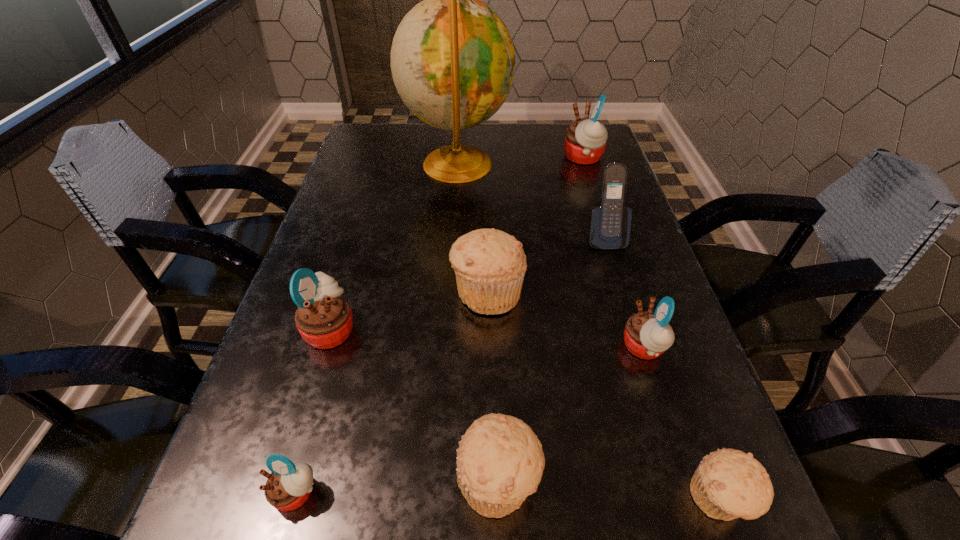
Find the location of a particular element. the tallest object is located at coordinates coord(453,62).

What are the coordinates of `the tallest muffin` in the screenshot? It's located at (585, 140).

Locate an element on the screen. This screenshot has height=540, width=960. the farthest muffin is located at coordinates (585, 140).

Identify the location of the seventh nearest object. The width and height of the screenshot is (960, 540). (610, 224).

The image size is (960, 540). I want to click on the second biggest pink muffin, so click(x=324, y=319).

Locate an element on the screen. The height and width of the screenshot is (540, 960). the farthest beige muffin is located at coordinates (489, 264).

The image size is (960, 540). Identify the location of the second smallest pink muffin. (647, 334).

The height and width of the screenshot is (540, 960). I want to click on the second smallest beige muffin, so click(500, 461).

You are a GUI agent. You are given a task and a screenshot of the screen. Output one action in this format:
    pyautogui.click(x=<x>, y=<y>)
    Task: Click on the smallest pink muffin
    The width and height of the screenshot is (960, 540).
    Given the screenshot: What is the action you would take?
    pyautogui.click(x=288, y=487)

Locate an element on the screen. the rightmost beige muffin is located at coordinates (728, 484).